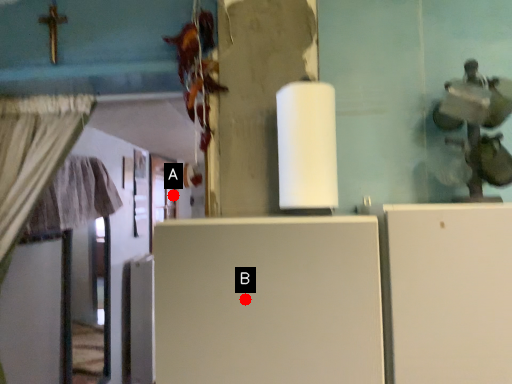
Question: Two points are circled on the image, labeled by A and B beside each circle. Which point is farther from the camera taking this photo?

Choices:
 (A) A is further
 (B) B is further

Answer: (A)